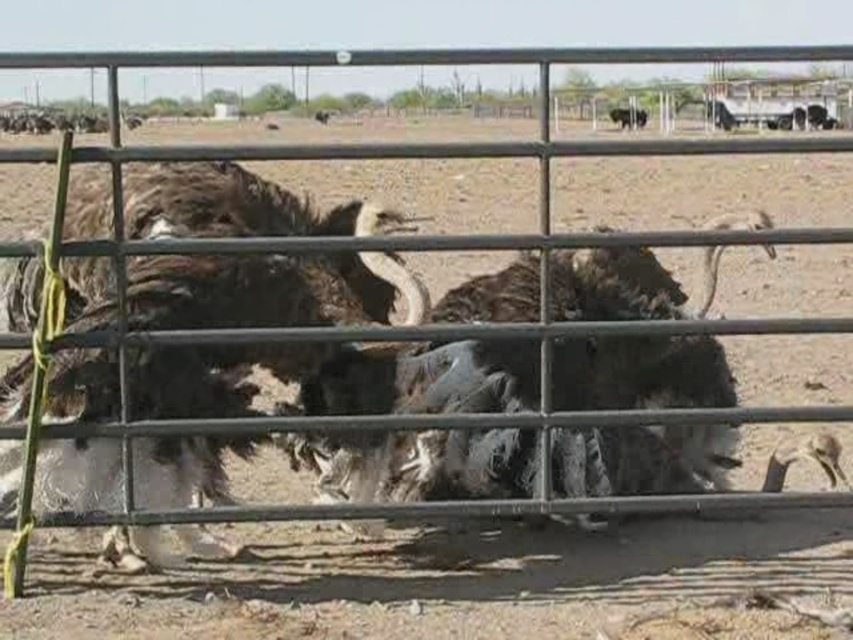
From the picture: Is fuzzy brown bison at center below brown fuzzy bison at upper right?

Indeed, fuzzy brown bison at center is positioned under brown fuzzy bison at upper right.

Is point (132, 472) closer to viewer compared to point (618, 115)?

Yes, it is in front of point (618, 115).

What are the coordinates of `fuzzy brown bison at center` in the screenshot? It's located at (268, 291).

Between shiny black car at upper right and brown fuzzy bison at upper right, which one has more height?

Standing taller between the two is shiny black car at upper right.

Who is more forward, [709,115] or [616,108]?

Positioned in front is point [709,115].

Between point (718, 118) and point (624, 120), which one is positioned in front?

Point (718, 118) is in front.

Identify the location of shiny black car at upper right. [718, 115].

From the picture: Is fuzzy brown bison at center shorter than shiny black car at upper right?

Incorrect, fuzzy brown bison at center's height does not fall short of shiny black car at upper right's.

Is point (96, 349) closer to viewer compared to point (728, 122)?

Yes, it is in front of point (728, 122).

The width and height of the screenshot is (853, 640). In order to click on fuzzy brown bison at center in this screenshot , I will do `click(268, 291)`.